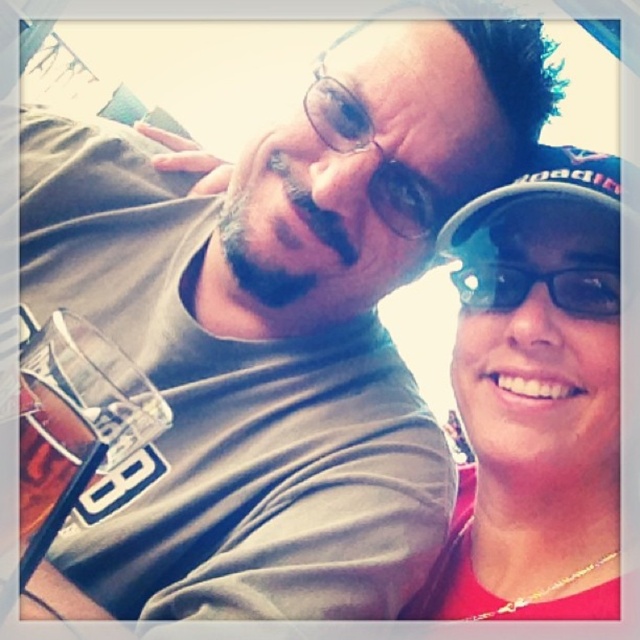
Does matte black cap at right appear on the right side of transparent plastic goggles at upper right?

Indeed, matte black cap at right is positioned on the right side of transparent plastic goggles at upper right.

Between matte black cap at right and transparent plastic goggles at upper right, which one has less height?

transparent plastic goggles at upper right

Measure the distance between matte black cap at right and camera.

They are 25.71 inches apart.

Image resolution: width=640 pixels, height=640 pixels. What are the coordinates of `matte black cap at right` in the screenshot? It's located at (536, 397).

Does matte black cap at right appear on the left side of black fabric baseball cap at upper right?

Yes, matte black cap at right is to the left of black fabric baseball cap at upper right.

Between matte black cap at right and black fabric baseball cap at upper right, which one is positioned lower?

matte black cap at right

The height and width of the screenshot is (640, 640). Identify the location of matte black cap at right. (536, 397).

Is black fabric baseball cap at upper right shorter than transparent plastic goggles at upper right?

No, black fabric baseball cap at upper right is not shorter than transparent plastic goggles at upper right.

Describe the element at coordinates (541, 193) in the screenshot. This screenshot has height=640, width=640. I see `black fabric baseball cap at upper right` at that location.

Where is `black fabric baseball cap at upper right`? Image resolution: width=640 pixels, height=640 pixels. black fabric baseball cap at upper right is located at coordinates (541, 193).